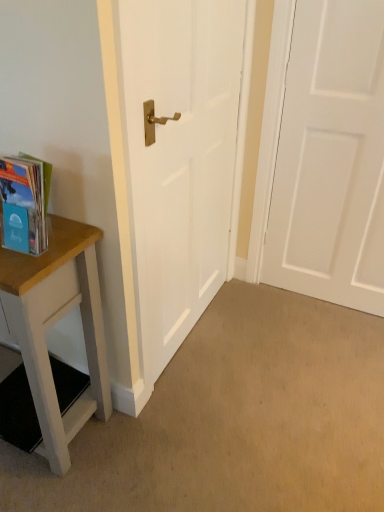
Question: Based on their sizes in the image, would you say translucent plastic book at left is bigger or smaller than white matte door at center, which appears as the 2th door when viewed from the right?

Choices:
 (A) big
 (B) small

Answer: (B)

Question: Is translucent plastic book at left in front of or behind white matte door at center, which is the 1th door in left-to-right order, in the image?

Choices:
 (A) behind
 (B) front

Answer: (B)

Question: Which is farther from the white matte door at center, which is the 1th door in left-to-right order?

Choices:
 (A) white matte door at right, which is the 1th door from right to left
 (B) translucent plastic book at left
 (C) wooden table at left

Answer: (A)

Question: Based on their relative distances, which object is farther from the white matte door at right, which appears as the second door when viewed from the left?

Choices:
 (A) wooden table at left
 (B) white matte door at center, which is the 1th door in left-to-right order
 (C) translucent plastic book at left

Answer: (C)